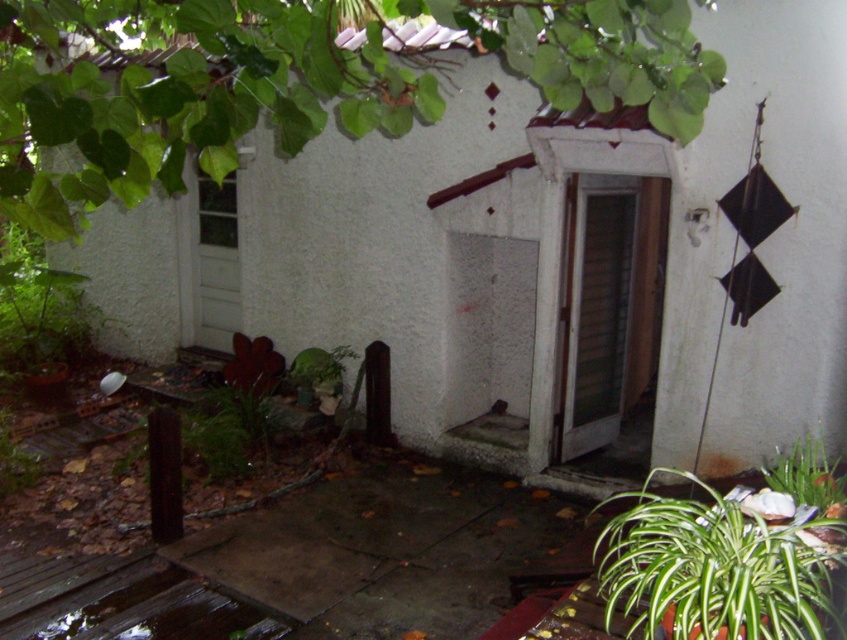
Between green leafy tree at upper center and green leafy plant at lower right, which one is positioned lower?

green leafy plant at lower right is below.

Which is behind, point (241, 68) or point (809, 520)?

The point (809, 520) is more distant.

Locate an element on the screen. green leafy tree at upper center is located at coordinates pos(299,81).